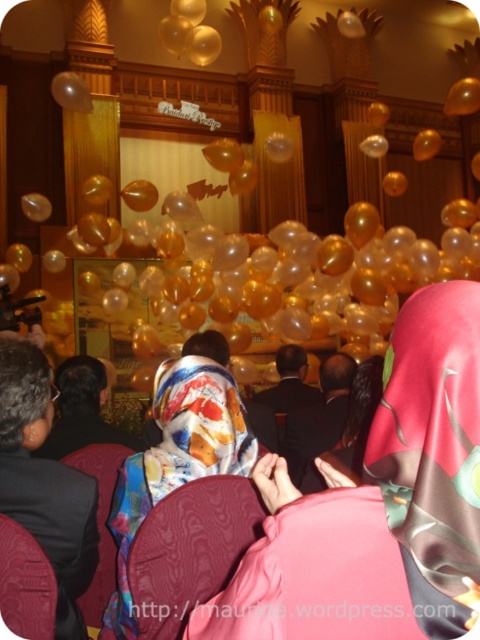
Question: Does silky floral hijab at center have a lesser width compared to floral silk hijab at center?

Choices:
 (A) yes
 (B) no

Answer: (B)

Question: Among these objects, which one is nearest to the camera?

Choices:
 (A) silky floral hijab at center
 (B) floral silk hijab at center

Answer: (A)

Question: Estimate the real-world distances between objects in this image. Which object is farther from the silky floral hijab at center?

Choices:
 (A) floral silk hijab at center
 (B) translucent gold balloon at upper center

Answer: (B)

Question: Can you confirm if floral silk hijab at center is bigger than translucent gold balloon at upper center?

Choices:
 (A) no
 (B) yes

Answer: (A)

Question: Which of the following is the closest to the observer?

Choices:
 (A) translucent gold balloon at upper center
 (B) floral silk hijab at center

Answer: (B)

Question: Can you confirm if silky floral hijab at center is smaller than translucent gold balloon at upper center?

Choices:
 (A) yes
 (B) no

Answer: (A)